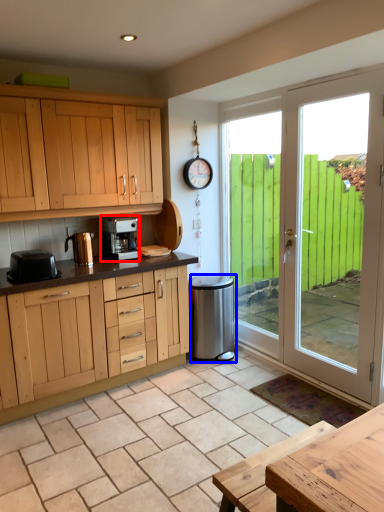
Question: Which object appears farthest to the camera in this image, kitchen appliance (highlighted by a red box) or appliance (highlighted by a blue box)?

Choices:
 (A) kitchen appliance
 (B) appliance

Answer: (B)